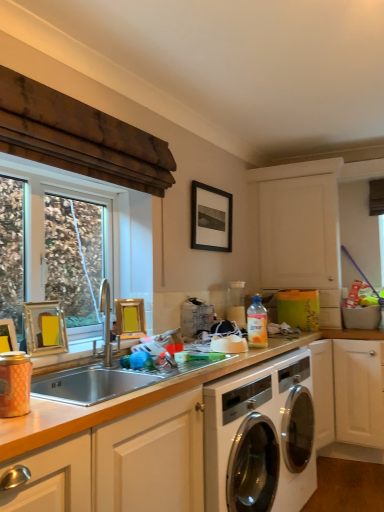
Question: Which direction should I rotate to face black matte picture frame at upper center, placed as the fourth picture frame when sorted from left to right, — up or down?

Choices:
 (A) down
 (B) up

Answer: (B)

Question: From the image's perspective, does silver metallic sink at center appear lower than white glossy washing machine at center?

Choices:
 (A) yes
 (B) no

Answer: (B)

Question: Is silver metallic sink at center in front of white glossy washing machine at center?

Choices:
 (A) no
 (B) yes

Answer: (B)

Question: Considering the relative sizes of silver metallic sink at center and white glossy washing machine at center in the image provided, is silver metallic sink at center taller than white glossy washing machine at center?

Choices:
 (A) yes
 (B) no

Answer: (B)

Question: Does silver metallic sink at center touch white glossy washing machine at center?

Choices:
 (A) yes
 (B) no

Answer: (B)

Question: Is silver metallic sink at center not near white glossy washing machine at center?

Choices:
 (A) yes
 (B) no

Answer: (B)

Question: Is silver metallic sink at center further to camera compared to white glossy washing machine at center?

Choices:
 (A) yes
 (B) no

Answer: (B)

Question: Is gold metallic picture frame at left, the 4th picture frame in the back-to-front sequence, to the left of black matte picture frame at upper center, placed as the fourth picture frame when sorted from left to right, from the viewer's perspective?

Choices:
 (A) yes
 (B) no

Answer: (A)

Question: Can you confirm if gold metallic picture frame at left, the 4th picture frame in the back-to-front sequence, is wider than black matte picture frame at upper center, which appears as the fourth picture frame when viewed from the front?

Choices:
 (A) yes
 (B) no

Answer: (A)

Question: Does gold metallic picture frame at left, which ranks as the third picture frame in top-to-bottom order, have a larger size compared to black matte picture frame at upper center, placed as the fourth picture frame when sorted from left to right?

Choices:
 (A) no
 (B) yes

Answer: (A)

Question: Does gold metallic picture frame at left, which appears as the second picture frame when ordered from the bottom, have a lesser height compared to black matte picture frame at upper center, the 1th picture frame from the back?

Choices:
 (A) no
 (B) yes

Answer: (B)

Question: Is gold metallic picture frame at left, the 4th picture frame viewed from the right, in front of black matte picture frame at upper center, arranged as the fourth picture frame when ordered from the bottom?

Choices:
 (A) no
 (B) yes

Answer: (B)

Question: Is gold metallic picture frame at left, which appears as the second picture frame when ordered from the bottom, to the right of black matte picture frame at upper center, placed as the 1th picture frame when sorted from top to bottom, from the viewer's perspective?

Choices:
 (A) yes
 (B) no

Answer: (B)

Question: Is matte pink canister at left not near gold metallic picture frame at left, the 4th picture frame in the back-to-front sequence?

Choices:
 (A) no
 (B) yes

Answer: (A)